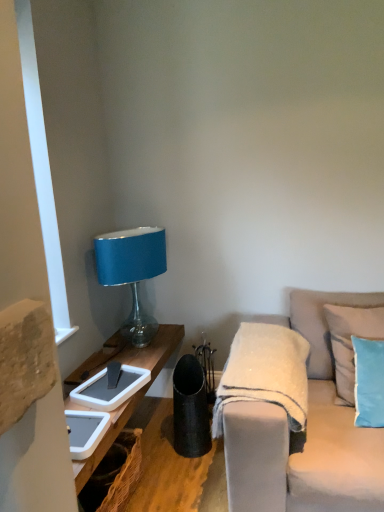
Question: Considering the relative sizes of light beige fabric couch at right and light blue fabric pillow at right, the first pillow when ordered from front to back, in the image provided, is light beige fabric couch at right shorter than light blue fabric pillow at right, the first pillow when ordered from front to back,?

Choices:
 (A) yes
 (B) no

Answer: (B)

Question: Can you confirm if light beige fabric couch at right is wider than light blue fabric pillow at right, the first pillow when ordered from front to back?

Choices:
 (A) no
 (B) yes

Answer: (B)

Question: Can you confirm if light beige fabric couch at right is bigger than light blue fabric pillow at right, positioned as the 2th pillow in back-to-front order?

Choices:
 (A) no
 (B) yes

Answer: (B)

Question: From the image's perspective, does light beige fabric couch at right appear lower than light blue fabric pillow at right, the first pillow when ordered from front to back?

Choices:
 (A) no
 (B) yes

Answer: (B)

Question: Are light beige fabric couch at right and light blue fabric pillow at right, the first pillow when ordered from front to back, making contact?

Choices:
 (A) no
 (B) yes

Answer: (A)

Question: Is light beige fabric couch at right to the right of light blue fabric pillow at right, positioned as the 2th pillow in back-to-front order, from the viewer's perspective?

Choices:
 (A) yes
 (B) no

Answer: (B)

Question: Is light blue fabric pillow at right, the first pillow when ordered from front to back, to the left of white fuzzy blanket at center from the viewer's perspective?

Choices:
 (A) yes
 (B) no

Answer: (B)

Question: Considering the relative positions of light blue fabric pillow at right, positioned as the 2th pillow in back-to-front order, and white fuzzy blanket at center in the image provided, is light blue fabric pillow at right, positioned as the 2th pillow in back-to-front order, behind white fuzzy blanket at center?

Choices:
 (A) no
 (B) yes

Answer: (B)

Question: Is light blue fabric pillow at right, positioned as the 2th pillow in back-to-front order, facing away from white fuzzy blanket at center?

Choices:
 (A) yes
 (B) no

Answer: (B)

Question: From the image's perspective, is light blue fabric pillow at right, the first pillow when ordered from front to back, on top of white fuzzy blanket at center?

Choices:
 (A) yes
 (B) no

Answer: (A)

Question: Is light blue fabric pillow at right, positioned as the 2th pillow in back-to-front order, wider than white fuzzy blanket at center?

Choices:
 (A) no
 (B) yes

Answer: (A)

Question: Can we say light blue fabric pillow at right, the first pillow when ordered from front to back, lies outside white fuzzy blanket at center?

Choices:
 (A) no
 (B) yes

Answer: (B)

Question: Can you confirm if light beige fabric couch at right is positioned to the right of white fuzzy blanket at center?

Choices:
 (A) no
 (B) yes

Answer: (B)